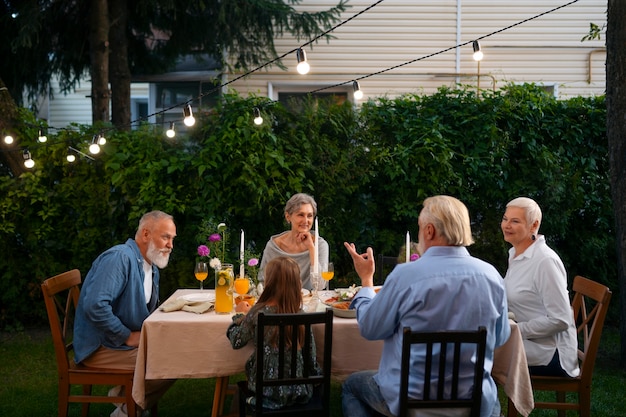
The image size is (626, 417). I want to click on chairs, so click(x=91, y=374), click(x=210, y=385), click(x=290, y=390), click(x=449, y=372), click(x=580, y=334).